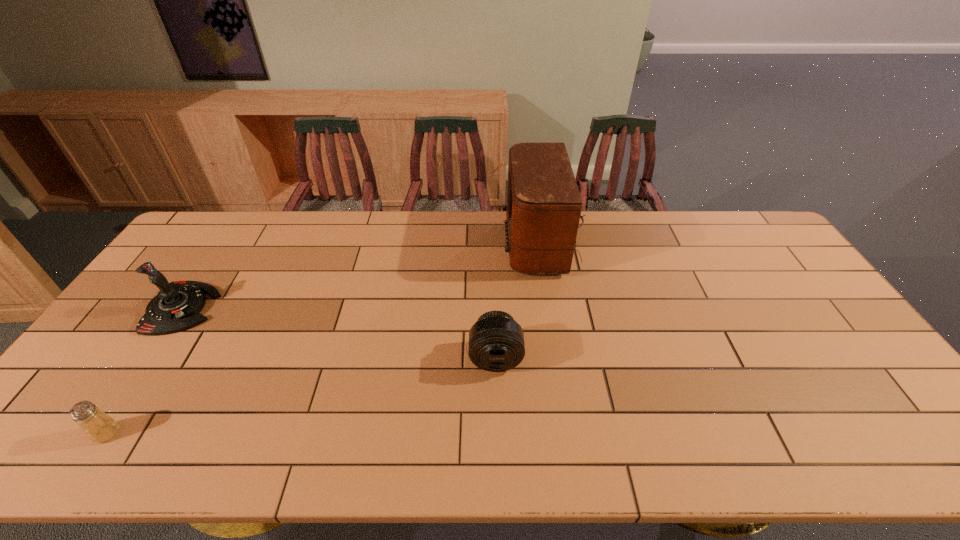
Locate an element on the screen. vacant space at the near edge of the desktop is located at coordinates (628, 438).

Where is `vacant space at the right edge of the desktop`? vacant space at the right edge of the desktop is located at coordinates (828, 350).

You are a GUI agent. You are given a task and a screenshot of the screen. Output one action in this format:
    pyautogui.click(x=<x>, y=<y>)
    Task: Click on the free region at the far left corner
    This screenshot has width=960, height=540.
    Given the screenshot: What is the action you would take?
    pyautogui.click(x=222, y=222)

You are a GUI agent. You are given a task and a screenshot of the screen. Output one action in this format:
    pyautogui.click(x=<x>, y=<y>)
    Task: Click on the vacant space at the near right corner of the desktop
    The height and width of the screenshot is (540, 960).
    Given the screenshot: What is the action you would take?
    pyautogui.click(x=918, y=427)

Locate an element on the screen. empty space that is in between the nearest object and the tallest object is located at coordinates (328, 338).

This screenshot has height=540, width=960. I want to click on vacant region between the radio receiver and the joystick, so click(366, 276).

You are a GUI agent. You are given a task and a screenshot of the screen. Output one action in this format:
    pyautogui.click(x=<x>, y=<y>)
    Task: Click on the free space between the joystick and the third farthest object
    The image size is (960, 540).
    Given the screenshot: What is the action you would take?
    pyautogui.click(x=339, y=333)

Locate an element on the screen. The height and width of the screenshot is (540, 960). free space between the saltshaker and the second tallest object is located at coordinates (145, 370).

Where is `blank region between the second shortest object and the farthest object`? This screenshot has width=960, height=540. blank region between the second shortest object and the farthest object is located at coordinates (522, 300).

In order to click on vacant region between the second nearest object and the radio receiver in this screenshot , I will do `click(522, 300)`.